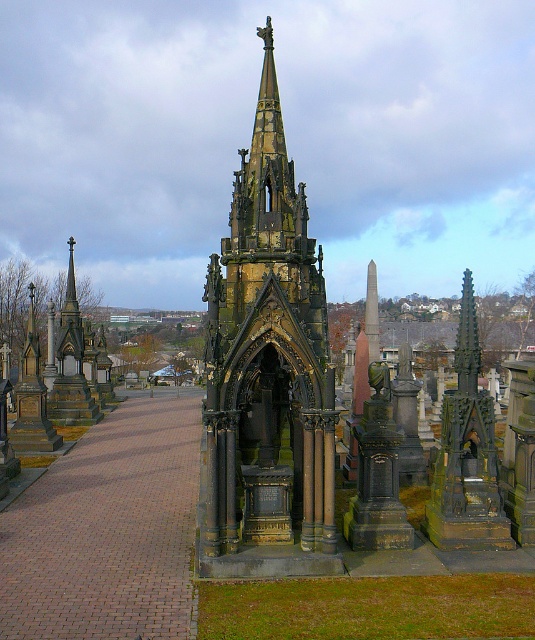
Question: Which point is farther to the camera?

Choices:
 (A) dark brown stone tower at center
 (B) dark brown stone spire at left

Answer: (B)

Question: In this image, where is dark brown stone tower at center located relative to dark brown stone spire at left?

Choices:
 (A) right
 (B) left

Answer: (A)

Question: Can you confirm if dark brown stone tower at center is positioned below dark brown stone spire at left?

Choices:
 (A) yes
 (B) no

Answer: (A)

Question: Can you confirm if dark brown stone tower at center is wider than dark brown stone spire at left?

Choices:
 (A) no
 (B) yes

Answer: (B)